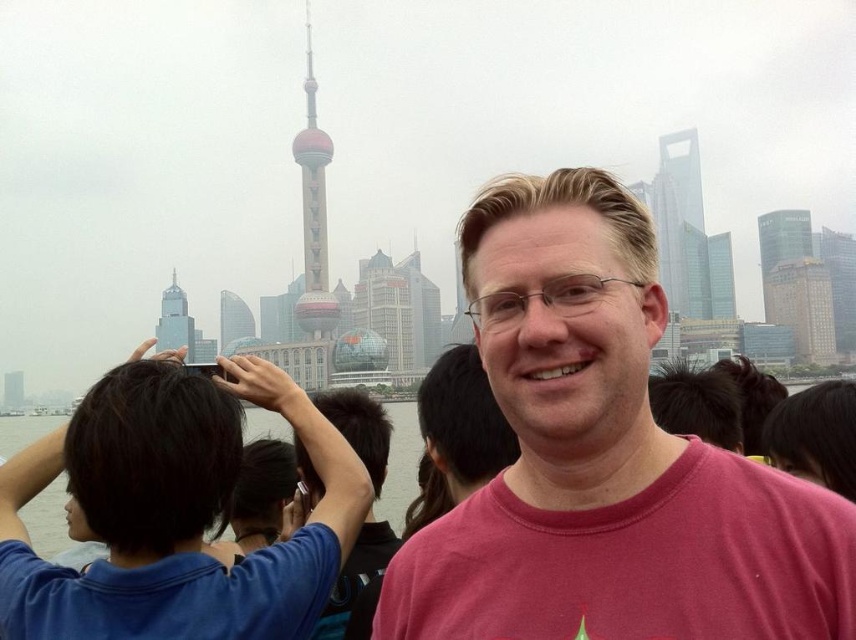
You are standing at the waterfront in Shanghai and want to take a photo of the shiny glass tower at center. According to the scene description, where should you position yourself to ensure the tower is centered in your shot?

The shiny glass tower at center is located at point (313, 211) in the image, so you should position yourself directly in front of that coordinate to center it in your photo.

You are a tourist visiting Shanghai and want to take a photo of both the shiny glass tower at center and the shiny glass skyscraper at center. Which one should you zoom in on more to ensure both fit in the frame?

You should zoom in more on the shiny glass skyscraper at center because it is wider than the shiny glass tower at center, so adjusting the zoom to accommodate its width will help both fit in the frame.